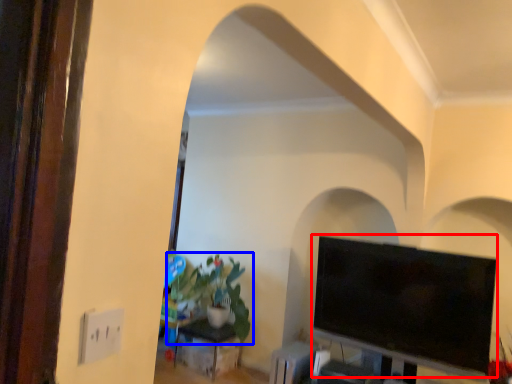
Question: Which of the following is the farthest to the observer, television (highlighted by a red box) or houseplant (highlighted by a blue box)?

Choices:
 (A) television
 (B) houseplant

Answer: (B)